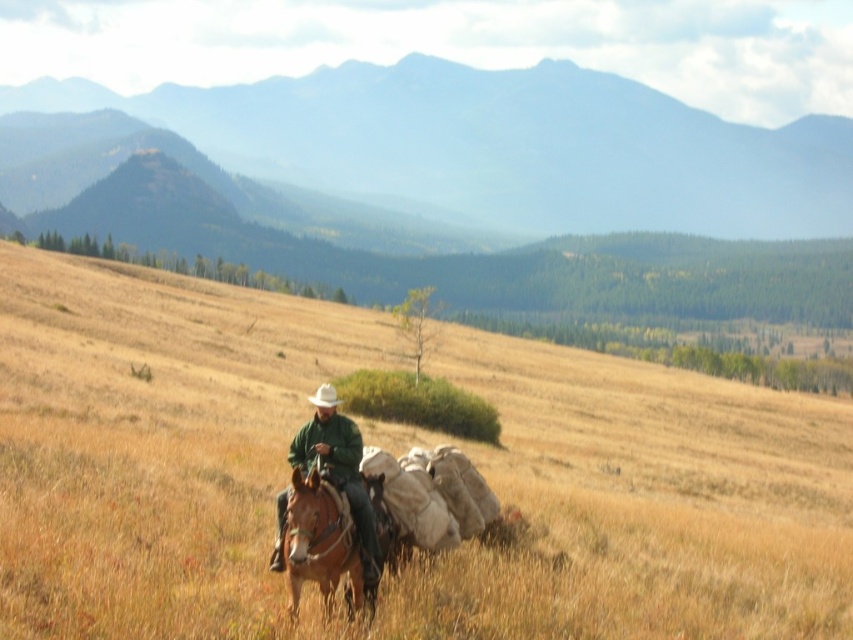
Question: Which point is closer to the camera taking this photo?

Choices:
 (A) (294, 480)
 (B) (283, 563)
 (C) (115, 584)

Answer: (A)

Question: In this image, where is dry grass at center located relative to green matte jacket at center?

Choices:
 (A) below
 (B) above

Answer: (A)

Question: Where is brown leather horse at center located in relation to green matte jacket at center in the image?

Choices:
 (A) left
 (B) right

Answer: (B)

Question: Which point is farther to the camera?

Choices:
 (A) dry grass at center
 (B) brown leather horse at center

Answer: (A)

Question: Which point is closer to the camera taking this photo?

Choices:
 (A) (334, 397)
 (B) (160, 365)
 (C) (349, 561)

Answer: (C)

Question: Does dry grass at center have a greater width compared to green matte jacket at center?

Choices:
 (A) yes
 (B) no

Answer: (A)